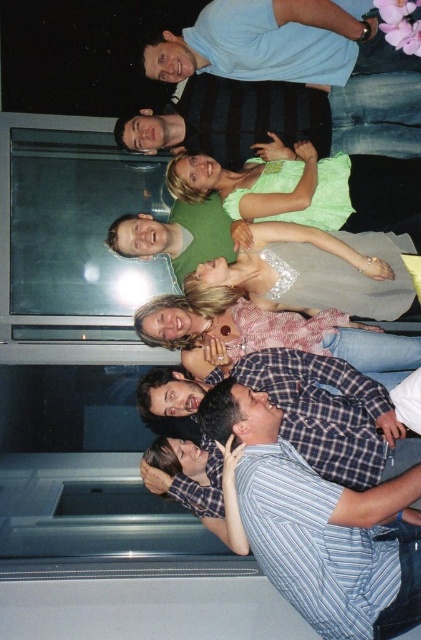
Looking at this image, you are a photographer trying to capture a group photo at night. You notice two people wearing light blue shirt at upper center and matte black shirt at upper center. Which one is positioned to the right side of the other?

The light blue shirt at upper center is positioned to the right of the matte black shirt at upper center.

You are a photographer trying to adjust the lighting for a group photo. You notice two shirts in the front row at upper center, a light blue shirt at upper center and a matte black shirt at upper center. Which shirt should you focus on to ensure proper exposure since it might be more affected by the artificial light?

The matte black shirt at upper center should be focused on for proper exposure because it has a greater height compared to the light blue shirt at upper center, making it more likely to be in the direct path of the artificial light sources.

You are a photographer trying to focus on the two upper center shirts in the image. Which one would appear more prominent in the photo, the matte black shirt at upper center or the green satin blouse at upper center?

The matte black shirt at upper center is larger in size than the green satin blouse at upper center, so it would appear more prominent in the photo.